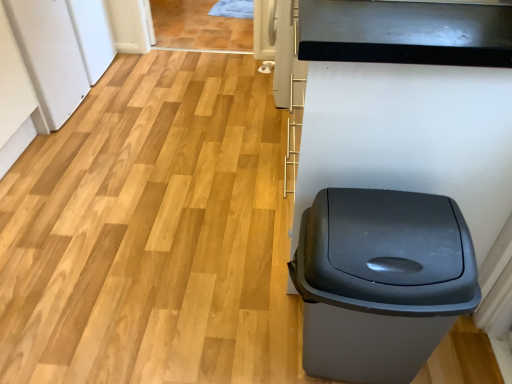
This screenshot has height=384, width=512. I want to click on white matte refrigerator at left, so click(50, 55).

What do you see at coordinates (50, 55) in the screenshot?
I see `white matte refrigerator at left` at bounding box center [50, 55].

Describe the element at coordinates (380, 281) in the screenshot. Image resolution: width=512 pixels, height=384 pixels. I see `matte gray plastic trash can at right` at that location.

This screenshot has height=384, width=512. In order to click on matte gray plastic trash can at right in this screenshot , I will do `click(380, 281)`.

Where is `white matte refrigerator at left`? This screenshot has height=384, width=512. white matte refrigerator at left is located at coordinates (50, 55).

Does matte gray plastic trash can at right appear on the right side of white matte refrigerator at left?

Correct, you'll find matte gray plastic trash can at right to the right of white matte refrigerator at left.

Which object is closer to the camera, matte gray plastic trash can at right or white matte refrigerator at left?

matte gray plastic trash can at right is more forward.

Considering the points (410, 368) and (28, 46), which point is in front, point (410, 368) or point (28, 46)?

Point (410, 368)

From the image's perspective, is matte gray plastic trash can at right above or below white matte refrigerator at left?

matte gray plastic trash can at right is situated lower than white matte refrigerator at left in the image.

From a real-world perspective, is matte gray plastic trash can at right positioned above or below white matte refrigerator at left?

In terms of real-world spatial position, matte gray plastic trash can at right is below white matte refrigerator at left.

Between matte gray plastic trash can at right and white matte refrigerator at left, which one has larger width?

With larger width is white matte refrigerator at left.

Between matte gray plastic trash can at right and white matte refrigerator at left, which one has more height?

Standing taller between the two is white matte refrigerator at left.

Is matte gray plastic trash can at right bigger than white matte refrigerator at left?

Actually, matte gray plastic trash can at right might be smaller than white matte refrigerator at left.

Which is correct: matte gray plastic trash can at right is inside white matte refrigerator at left, or outside of it?

matte gray plastic trash can at right exists outside the volume of white matte refrigerator at left.

Is matte gray plastic trash can at right touching white matte refrigerator at left?

No, matte gray plastic trash can at right is not next to white matte refrigerator at left.

Is matte gray plastic trash can at right facing away from white matte refrigerator at left?

matte gray plastic trash can at right does not have its back to white matte refrigerator at left.

At what (x,y) coordinates should I click in order to perform the action: click on waste container located on the right of white matte refrigerator at left. Please return your answer as a coordinate pair (x, y). This screenshot has height=384, width=512. Looking at the image, I should click on (380, 281).

Does white matte refrigerator at left appear on the left side of matte gray plastic trash can at right?

Yes.

Is white matte refrigerator at left positioned behind matte gray plastic trash can at right?

Yes.

Considering the points (80, 92) and (408, 316), which point is behind, point (80, 92) or point (408, 316)?

The point (80, 92) is farther from the camera.

From the image's perspective, is white matte refrigerator at left above or below matte gray plastic trash can at right?

Clearly, from the image's perspective, white matte refrigerator at left is above matte gray plastic trash can at right.

From a real-world perspective, is white matte refrigerator at left on matte gray plastic trash can at right?

Yes, from a real-world perspective, white matte refrigerator at left is over matte gray plastic trash can at right

Considering the sizes of objects white matte refrigerator at left and matte gray plastic trash can at right in the image provided, who is thinner, white matte refrigerator at left or matte gray plastic trash can at right?

matte gray plastic trash can at right is thinner.

Can you confirm if white matte refrigerator at left is shorter than matte gray plastic trash can at right?

Incorrect, the height of white matte refrigerator at left does not fall short of that of matte gray plastic trash can at right.

Based on the photo, can you confirm if white matte refrigerator at left is smaller than matte gray plastic trash can at right?

Actually, white matte refrigerator at left might be larger than matte gray plastic trash can at right.

Is white matte refrigerator at left surrounding matte gray plastic trash can at right?

Definitely not — matte gray plastic trash can at right is not inside white matte refrigerator at left.

Is white matte refrigerator at left touching matte gray plastic trash can at right?

white matte refrigerator at left and matte gray plastic trash can at right are not in contact.

Does white matte refrigerator at left turn towards matte gray plastic trash can at right?

No, white matte refrigerator at left does not turn towards matte gray plastic trash can at right.

Can you tell me how much white matte refrigerator at left and matte gray plastic trash can at right differ in facing direction?

The facing directions of white matte refrigerator at left and matte gray plastic trash can at right are 91.5 degrees apart.

At what (x,y) coordinates should I click in order to perform the action: click on waste container that appears below the white matte refrigerator at left (from the image's perspective). Please return your answer as a coordinate pair (x, y). Looking at the image, I should click on (380, 281).

You are a GUI agent. You are given a task and a screenshot of the screen. Output one action in this format:
    pyautogui.click(x=<x>, y=<y>)
    Task: Click on the appliance behind the matte gray plastic trash can at right
    Image resolution: width=512 pixels, height=384 pixels.
    Given the screenshot: What is the action you would take?
    pyautogui.click(x=50, y=55)

I want to click on waste container beneath the white matte refrigerator at left (from a real-world perspective), so click(x=380, y=281).